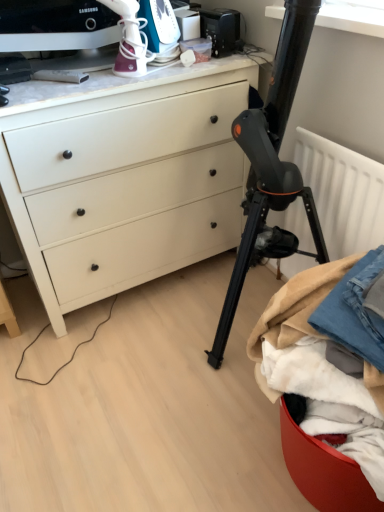
Question: Does denim fabric at lower right, arranged as the 2th clothing when viewed from the left, have a larger size compared to denim fabric at lower right, acting as the 1th clothing starting from the left?

Choices:
 (A) no
 (B) yes

Answer: (A)

Question: Is the depth of denim fabric at lower right, arranged as the 2th clothing when viewed from the left, greater than that of denim fabric at lower right, acting as the 1th clothing starting from the left?

Choices:
 (A) no
 (B) yes

Answer: (B)

Question: Is denim fabric at lower right, acting as the first clothing starting from the right, to the right of denim fabric at lower right, placed as the 2th clothing when sorted from right to left, from the viewer's perspective?

Choices:
 (A) yes
 (B) no

Answer: (A)

Question: Is denim fabric at lower right, acting as the first clothing starting from the right, outside denim fabric at lower right, acting as the 1th clothing starting from the left?

Choices:
 (A) yes
 (B) no

Answer: (B)

Question: Considering the relative sizes of denim fabric at lower right, acting as the first clothing starting from the right, and denim fabric at lower right, acting as the 1th clothing starting from the left, in the image provided, is denim fabric at lower right, acting as the first clothing starting from the right, thinner than denim fabric at lower right, acting as the 1th clothing starting from the left,?

Choices:
 (A) no
 (B) yes

Answer: (B)

Question: Does denim fabric at lower right, arranged as the 2th clothing when viewed from the left, have a greater width compared to denim fabric at lower right, acting as the 1th clothing starting from the left?

Choices:
 (A) no
 (B) yes

Answer: (A)

Question: Is denim fabric at lower right, acting as the 1th clothing starting from the left, positioned with its back to white plastic iron at upper center, which is the 1th appliance from left to right?

Choices:
 (A) no
 (B) yes

Answer: (A)

Question: Can we say denim fabric at lower right, placed as the 2th clothing when sorted from right to left, lies outside white plastic iron at upper center, which is the 1th appliance from left to right?

Choices:
 (A) no
 (B) yes

Answer: (B)

Question: Does denim fabric at lower right, acting as the 1th clothing starting from the left, have a smaller size compared to white plastic iron at upper center, which is the 1th appliance from left to right?

Choices:
 (A) no
 (B) yes

Answer: (A)

Question: From the image's perspective, is denim fabric at lower right, placed as the 2th clothing when sorted from right to left, on top of white plastic iron at upper center, positioned as the second appliance in right-to-left order?

Choices:
 (A) yes
 (B) no

Answer: (B)

Question: Can you see denim fabric at lower right, placed as the 2th clothing when sorted from right to left, touching white plastic iron at upper center, positioned as the second appliance in right-to-left order?

Choices:
 (A) yes
 (B) no

Answer: (B)

Question: Is denim fabric at lower right, placed as the 2th clothing when sorted from right to left, wider than white plastic iron at upper center, which is the 1th appliance from left to right?

Choices:
 (A) yes
 (B) no

Answer: (A)

Question: Can you confirm if matte white chest of drawers at upper left is bigger than denim fabric at lower right, placed as the 2th clothing when sorted from right to left?

Choices:
 (A) no
 (B) yes

Answer: (B)